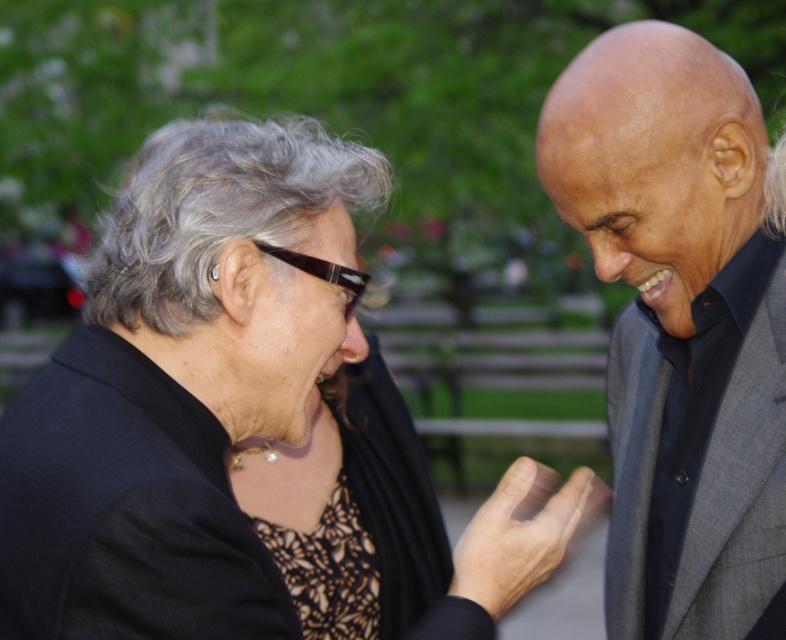
Is gray suit at right positioned at the back of gray wool business suit at right?

No, it is not.

Does gray suit at right have a greater height compared to gray wool business suit at right?

Yes.

Which is in front, point (759, 308) or point (621, 572)?

Positioned in front is point (759, 308).

At what (x,y) coordinates should I click in order to perform the action: click on gray suit at right. Please return your answer as a coordinate pair (x, y). The width and height of the screenshot is (786, 640). Looking at the image, I should click on (678, 323).